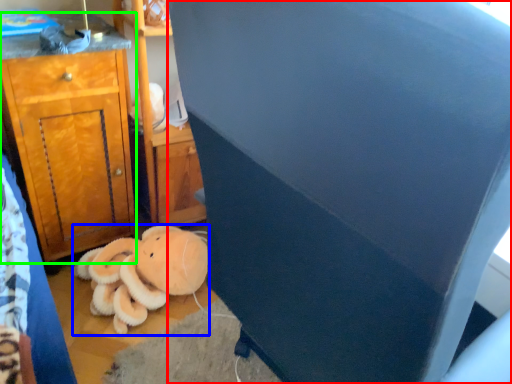
Question: Estimate the real-world distances between objects in this image. Which object is farther from furniture (highlighted by a red box), teddy bear (highlighted by a blue box) or cabinetry (highlighted by a green box)?

Choices:
 (A) teddy bear
 (B) cabinetry

Answer: (B)